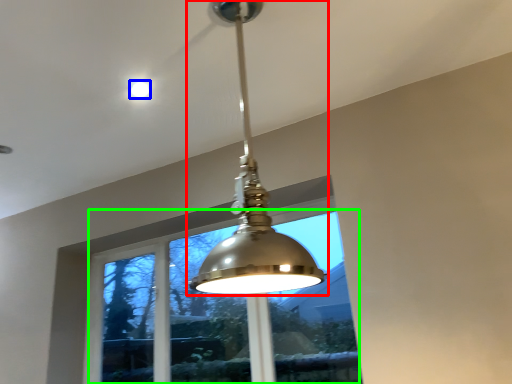
Question: Based on their relative distances, which object is farther from lamp (highlighted by a red box)? Choose from droplight (highlighted by a blue box) and window (highlighted by a green box).

Choices:
 (A) droplight
 (B) window

Answer: (B)